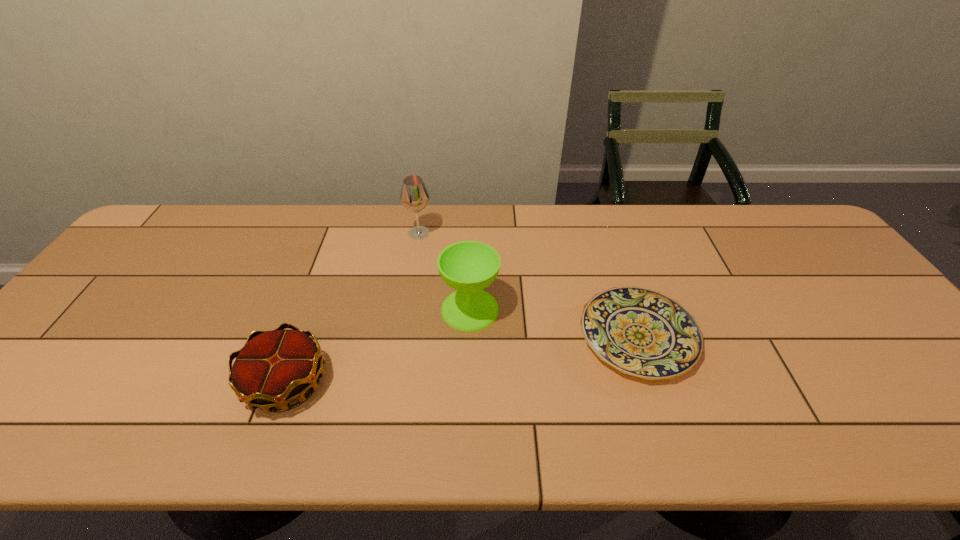
Find the location of a particular element. This screenshot has width=960, height=540. the farther wineglass is located at coordinates (414, 196).

Identify the location of the left wineglass. (414, 196).

At what (x,y) coordinates should I click in order to perform the action: click on the nearer wineglass. Please return your answer as a coordinate pair (x, y). This screenshot has height=540, width=960. Looking at the image, I should click on (468, 266).

This screenshot has height=540, width=960. I want to click on the right wineglass, so pos(468,266).

This screenshot has width=960, height=540. Find the location of `crown`. crown is located at coordinates (274, 368).

The height and width of the screenshot is (540, 960). Identify the location of the leftmost object. (274, 368).

Locate an element on the screen. Image resolution: width=960 pixels, height=540 pixels. the shortest object is located at coordinates (640, 332).

Where is `the rightmost object`? The image size is (960, 540). the rightmost object is located at coordinates (640, 332).

The image size is (960, 540). Identify the location of free spot located on the front of the farther wineglass. (410, 293).

Identify the location of vacant space located 0.360m on the back of the right wineglass. click(x=472, y=212).